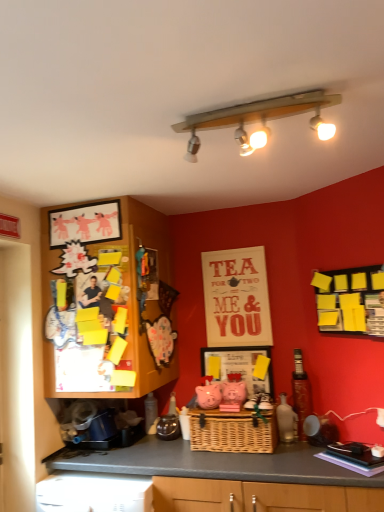
Question: Considering the relative positions of wooden picture frame at upper left, which appears as the 1th picture frame when viewed from the top, and matte white picture frame at center, placed as the second picture frame when sorted from left to right, in the image provided, is wooden picture frame at upper left, which appears as the 1th picture frame when viewed from the top, to the left of matte white picture frame at center, placed as the second picture frame when sorted from left to right, from the viewer's perspective?

Choices:
 (A) yes
 (B) no

Answer: (A)

Question: Is wooden picture frame at upper left, which appears as the 1th picture frame when viewed from the top, taller than matte white picture frame at center, which ranks as the 2th picture frame in top-to-bottom order?

Choices:
 (A) no
 (B) yes

Answer: (A)

Question: From a real-world perspective, is wooden picture frame at upper left, which appears as the 1th picture frame when viewed from the top, on top of matte white picture frame at center, which is counted as the second picture frame, starting from the front?

Choices:
 (A) no
 (B) yes

Answer: (B)

Question: Is wooden picture frame at upper left, which is the 2th picture frame from bottom to top, outside matte white picture frame at center, placed as the second picture frame when sorted from left to right?

Choices:
 (A) no
 (B) yes

Answer: (B)

Question: Is wooden picture frame at upper left, which is the 2th picture frame from bottom to top, smaller than matte white picture frame at center, which is counted as the 1th picture frame, starting from the right?

Choices:
 (A) yes
 (B) no

Answer: (A)

Question: From a real-world perspective, does wooden picture frame at upper left, acting as the first picture frame starting from the front, sit lower than matte white picture frame at center, placed as the second picture frame when sorted from left to right?

Choices:
 (A) yes
 (B) no

Answer: (B)

Question: From a real-world perspective, is woven brown basket at center below wooden picture frame at upper left, the 1th picture frame from the left?

Choices:
 (A) yes
 (B) no

Answer: (A)

Question: Is woven brown basket at center thinner than wooden picture frame at upper left, the 1th picture frame from the left?

Choices:
 (A) yes
 (B) no

Answer: (B)

Question: Is woven brown basket at center bigger than wooden picture frame at upper left, which is the second picture frame in right-to-left order?

Choices:
 (A) no
 (B) yes

Answer: (B)

Question: Considering the relative positions of woven brown basket at center and wooden picture frame at upper left, which is the 2th picture frame from bottom to top, in the image provided, is woven brown basket at center in front of wooden picture frame at upper left, which is the 2th picture frame from bottom to top,?

Choices:
 (A) no
 (B) yes

Answer: (B)

Question: Is woven brown basket at center next to wooden picture frame at upper left, which is the 2th picture frame from bottom to top?

Choices:
 (A) yes
 (B) no

Answer: (B)

Question: Can you confirm if woven brown basket at center is positioned to the right of wooden picture frame at upper left, the 1th picture frame from the left?

Choices:
 (A) yes
 (B) no

Answer: (A)

Question: Is shiny metallic bottle at right at the left side of wooden picture frame at upper left, acting as the first picture frame starting from the front?

Choices:
 (A) no
 (B) yes

Answer: (A)